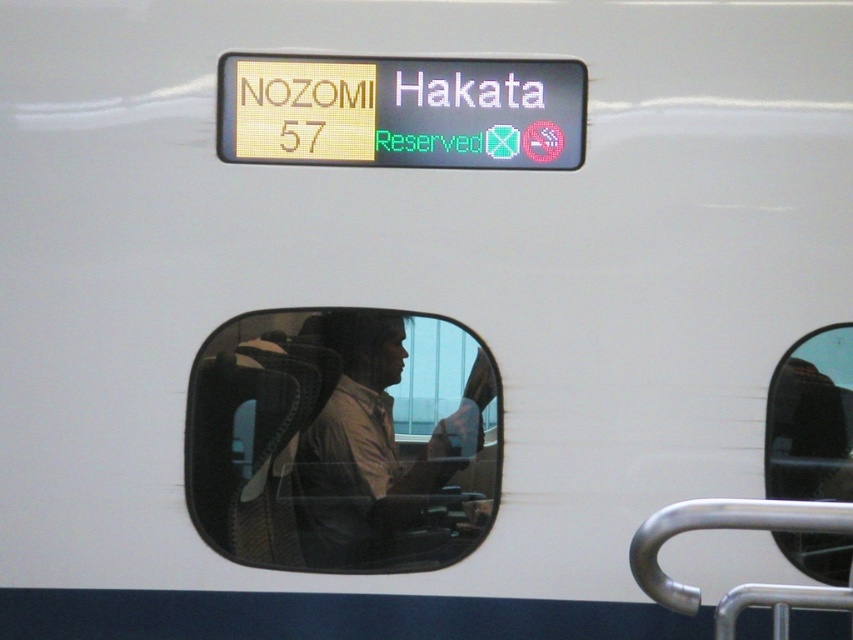
Question: Is yellow plastic sign at upper center smaller than transparent glass window at lower right?

Choices:
 (A) yes
 (B) no

Answer: (A)

Question: Which of the following is the closest to the observer?

Choices:
 (A) transparent glass train window at center
 (B) yellow plastic sign at upper center
 (C) silver metallic handrail at lower right
 (D) transparent glass window at lower right

Answer: (C)

Question: Is transparent glass window at lower right below silver metallic handrail at lower right?

Choices:
 (A) yes
 (B) no

Answer: (B)

Question: Which point is farther to the camera?

Choices:
 (A) silver metallic handrail at lower right
 (B) yellow plastic sign at upper center

Answer: (B)

Question: Which of the following is the closest to the observer?

Choices:
 (A) silver metallic handrail at lower right
 (B) transparent glass window at lower right

Answer: (A)

Question: Can you confirm if transparent glass train window at center is wider than transparent glass window at lower right?

Choices:
 (A) no
 (B) yes

Answer: (B)